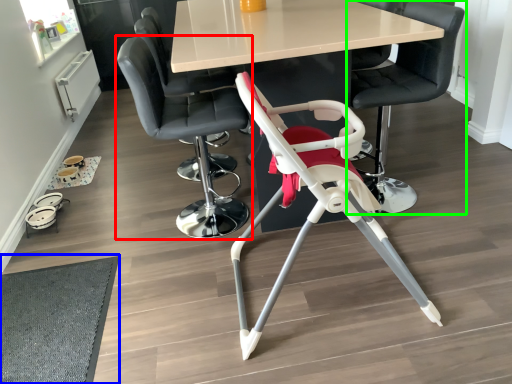
Question: Which is nearer to the chair (highlighted by a red box)? mat (highlighted by a blue box) or chair (highlighted by a green box).

Choices:
 (A) mat
 (B) chair

Answer: (A)